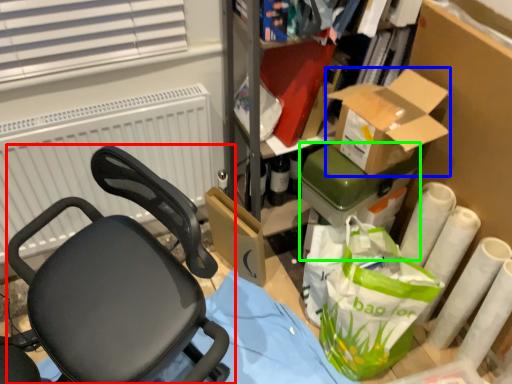
Question: Which is farther away from chair (highlighted by a red box)? box (highlighted by a blue box) or box (highlighted by a green box)?

Choices:
 (A) box
 (B) box

Answer: (A)